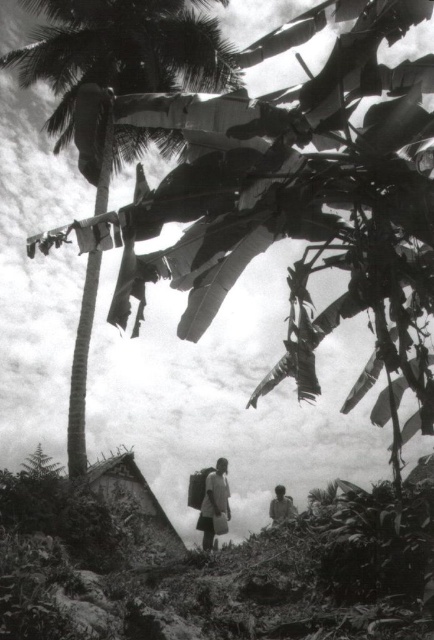
You are standing in the middle of the scene and want to walk towards both point (x=111, y=65) and point (x=207, y=516). Which point will you reach first?

You will reach point (x=111, y=65) first because it is closer to you than point (x=207, y=516), which is further away.

You are a photographer standing in the scene and want to capture both the smooth brown palm tree at center and the light brown fabric shirt at lower right in the same frame. Which object should you focus on first to ensure both are in the frame?

The smooth brown palm tree at center is taller than the light brown fabric shirt at lower right. To ensure both are in the frame, focus on the taller palm tree first, then adjust the camera to include the shorter shirt.